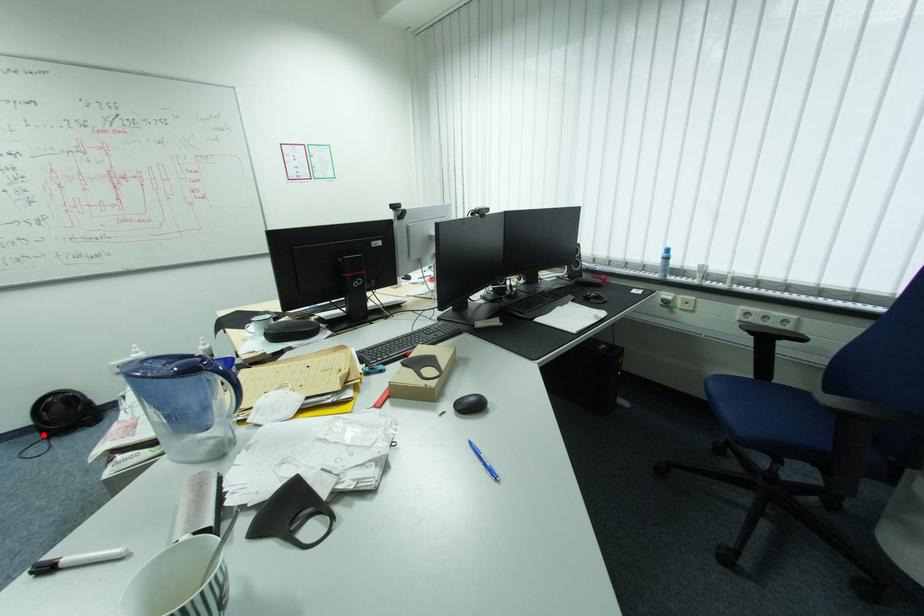
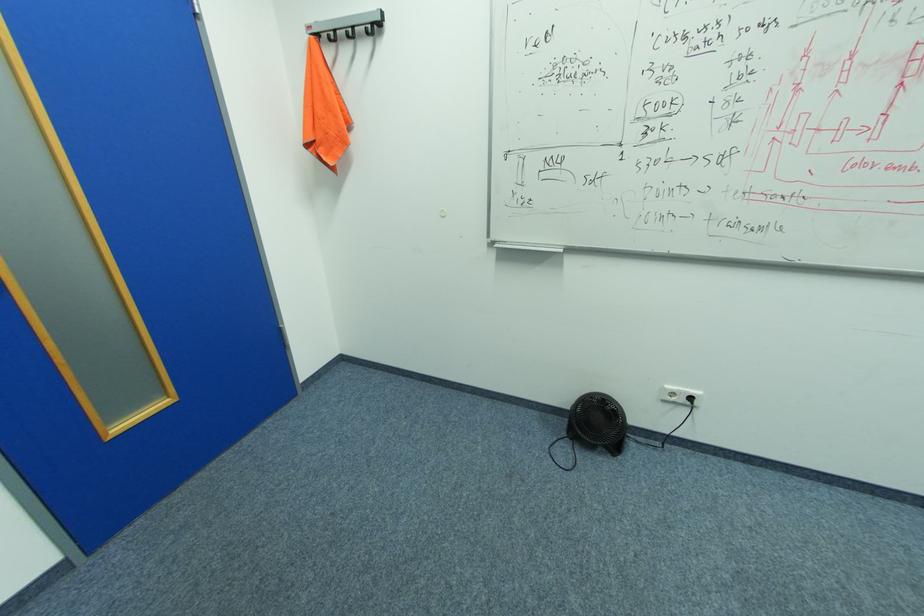
Locate, in the second image, the point that corresponds to the highlighted location in the first image.

(568, 423)